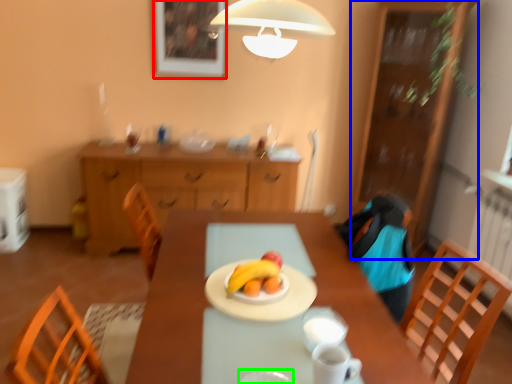
Question: Which is farther away from picture frame (highlighted by a red box)? cabinetry (highlighted by a blue box) or tableware (highlighted by a green box)?

Choices:
 (A) cabinetry
 (B) tableware

Answer: (B)